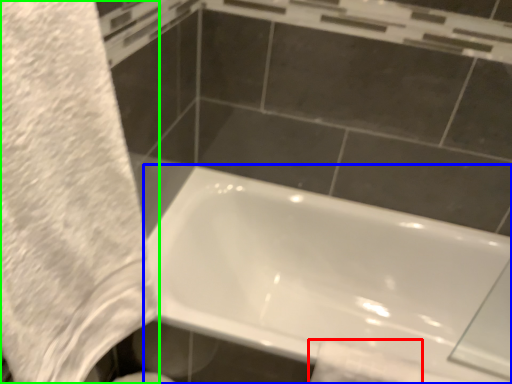
Question: Which object is the closest to the toilet paper (highlighted by a red box)? Choose among these: bathtub (highlighted by a blue box) or bath towel (highlighted by a green box).

Choices:
 (A) bathtub
 (B) bath towel

Answer: (A)